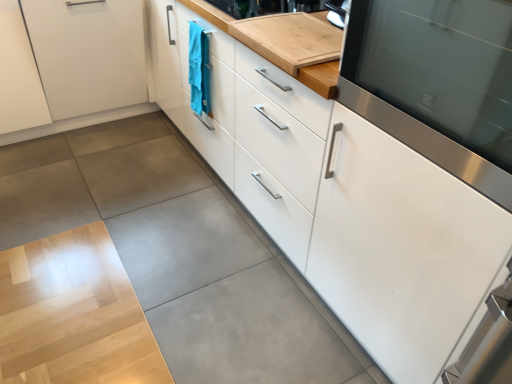
Question: Is bamboo cutting board at upper center positioned far away from white glossy cabinet at right, which is the 1th cabinetry from right to left?

Choices:
 (A) no
 (B) yes

Answer: (A)

Question: From a real-world perspective, does bamboo cutting board at upper center stand above white glossy cabinet at right, marked as the third cabinetry in a left-to-right arrangement?

Choices:
 (A) yes
 (B) no

Answer: (A)

Question: Is bamboo cutting board at upper center shorter than white glossy cabinet at right, marked as the third cabinetry in a left-to-right arrangement?

Choices:
 (A) yes
 (B) no

Answer: (A)

Question: From the image's perspective, does bamboo cutting board at upper center appear lower than white glossy cabinet at right, marked as the third cabinetry in a left-to-right arrangement?

Choices:
 (A) no
 (B) yes

Answer: (A)

Question: Does bamboo cutting board at upper center have a greater width compared to white glossy cabinet at right, marked as the third cabinetry in a left-to-right arrangement?

Choices:
 (A) yes
 (B) no

Answer: (B)

Question: Does bamboo cutting board at upper center have a greater height compared to white glossy cabinet at right, which is the 1th cabinetry from right to left?

Choices:
 (A) yes
 (B) no

Answer: (B)

Question: From the image's perspective, does bamboo cutting board at upper center appear lower than teal fabric towel at center?

Choices:
 (A) yes
 (B) no

Answer: (A)

Question: Could you tell me if bamboo cutting board at upper center is turned towards teal fabric towel at center?

Choices:
 (A) yes
 (B) no

Answer: (B)

Question: Does bamboo cutting board at upper center touch teal fabric towel at center?

Choices:
 (A) yes
 (B) no

Answer: (B)

Question: Considering the relative sizes of bamboo cutting board at upper center and teal fabric towel at center in the image provided, is bamboo cutting board at upper center wider than teal fabric towel at center?

Choices:
 (A) yes
 (B) no

Answer: (A)

Question: Does bamboo cutting board at upper center have a smaller size compared to teal fabric towel at center?

Choices:
 (A) yes
 (B) no

Answer: (B)

Question: From a real-world perspective, is bamboo cutting board at upper center physically below teal fabric towel at center?

Choices:
 (A) no
 (B) yes

Answer: (A)

Question: Considering the relative sizes of teal fabric towel at center and stainless steel oven at right in the image provided, is teal fabric towel at center wider than stainless steel oven at right?

Choices:
 (A) yes
 (B) no

Answer: (B)